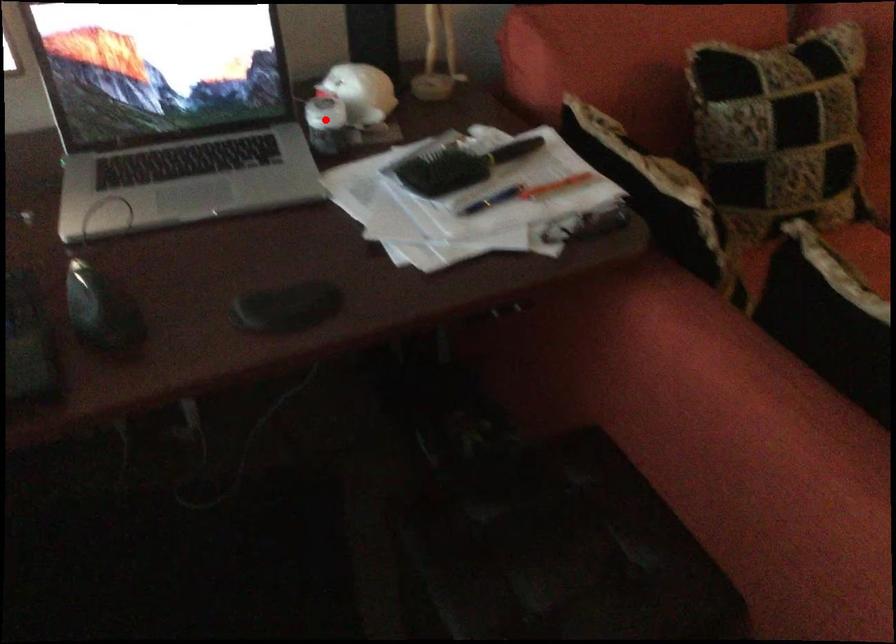
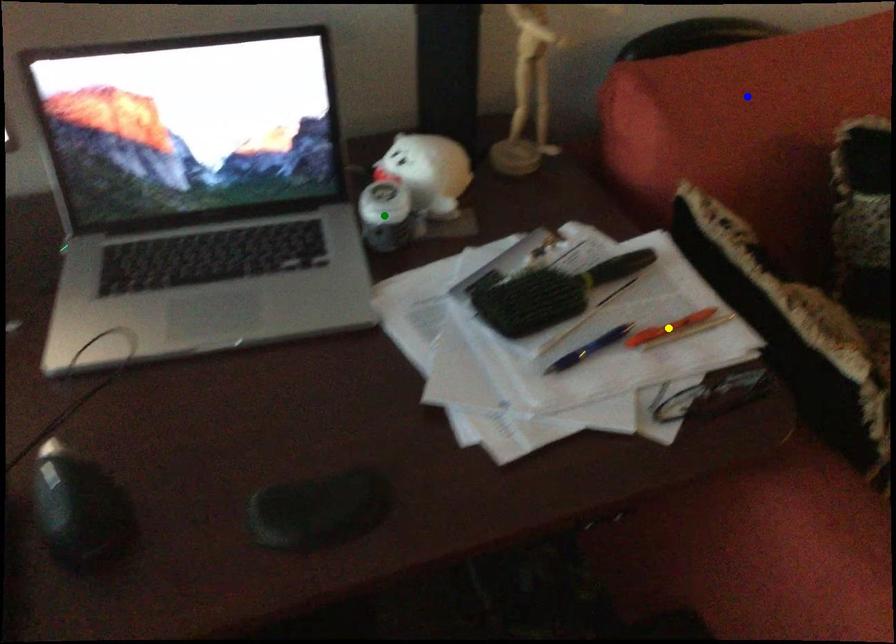
Question: I am providing you with two images of the same scene from different viewpoints. A red point is marked on the first image. You are given multiple points on the second image. Which point in image 2 represents the same 3d spot as the red point in image 1?

Choices:
 (A) yellow point
 (B) green point
 (C) blue point

Answer: (B)